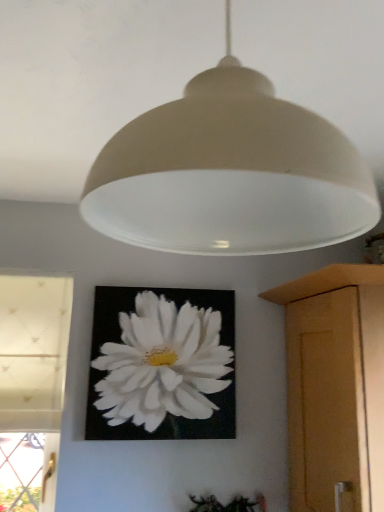
Question: Is white matte flower at center located within wooden cabinet at right?

Choices:
 (A) no
 (B) yes

Answer: (A)

Question: Is wooden cabinet at right completely or partially outside of white matte flower at center?

Choices:
 (A) no
 (B) yes

Answer: (B)

Question: From the image's perspective, is wooden cabinet at right below white matte flower at center?

Choices:
 (A) yes
 (B) no

Answer: (A)

Question: Is wooden cabinet at right wider than white matte flower at center?

Choices:
 (A) yes
 (B) no

Answer: (A)

Question: From the image's perspective, is wooden cabinet at right located above white matte flower at center?

Choices:
 (A) no
 (B) yes

Answer: (A)

Question: Is wooden cabinet at right smaller than white matte flower at center?

Choices:
 (A) yes
 (B) no

Answer: (B)

Question: Is matte white lampshade at upper center inside white matte flower at center?

Choices:
 (A) yes
 (B) no

Answer: (B)

Question: Can you see white matte flower at center touching matte white lampshade at upper center?

Choices:
 (A) no
 (B) yes

Answer: (A)

Question: Is white matte flower at center at the left side of matte white lampshade at upper center?

Choices:
 (A) yes
 (B) no

Answer: (A)

Question: Can you confirm if white matte flower at center is shorter than matte white lampshade at upper center?

Choices:
 (A) no
 (B) yes

Answer: (A)

Question: Is white matte flower at center further to the viewer compared to matte white lampshade at upper center?

Choices:
 (A) yes
 (B) no

Answer: (A)

Question: From the image's perspective, is white matte flower at center over matte white lampshade at upper center?

Choices:
 (A) yes
 (B) no

Answer: (B)

Question: Does matte white lampshade at upper center touch green matte plant at lower center?

Choices:
 (A) no
 (B) yes

Answer: (A)